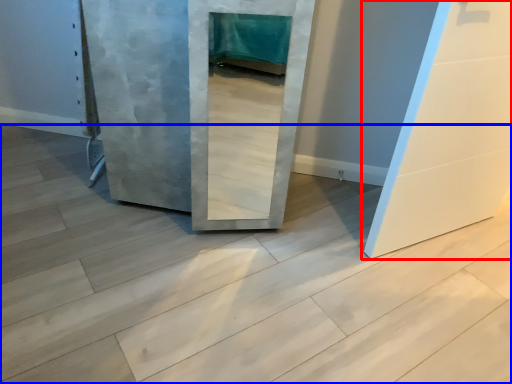
Question: Which object is closer to the camera taking this photo, door (highlighted by a red box) or concrete (highlighted by a blue box)?

Choices:
 (A) door
 (B) concrete

Answer: (B)